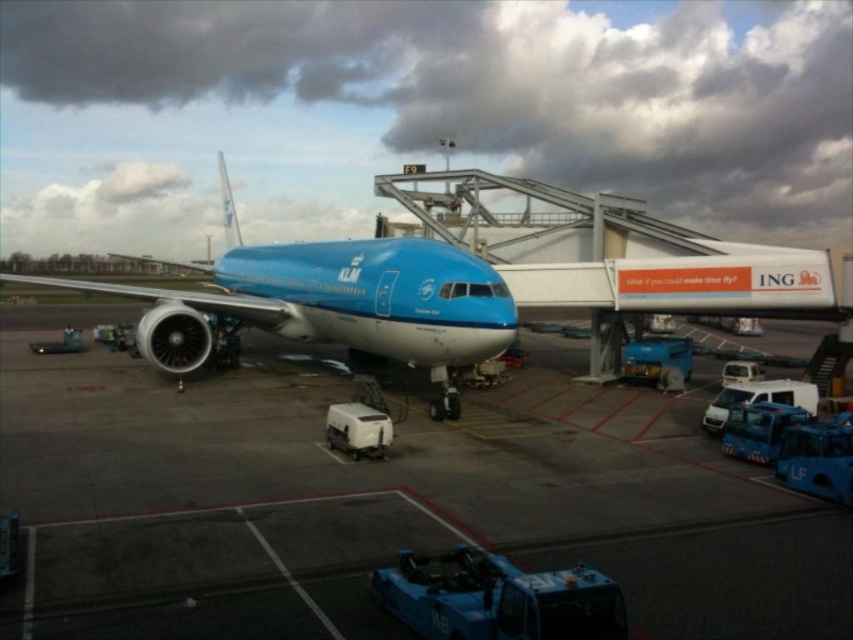
Question: Among these objects, which one is nearest to the camera?

Choices:
 (A) matte white tarmac at center
 (B) matte blue airplane at center

Answer: (A)

Question: Does matte white tarmac at center have a smaller size compared to matte blue airplane at center?

Choices:
 (A) yes
 (B) no

Answer: (A)

Question: Which point is farther to the camera?

Choices:
 (A) (335, 269)
 (B) (659, 500)

Answer: (A)

Question: Is matte white tarmac at center to the left of matte blue airplane at center from the viewer's perspective?

Choices:
 (A) yes
 (B) no

Answer: (B)

Question: Can you confirm if matte white tarmac at center is wider than matte blue airplane at center?

Choices:
 (A) no
 (B) yes

Answer: (A)